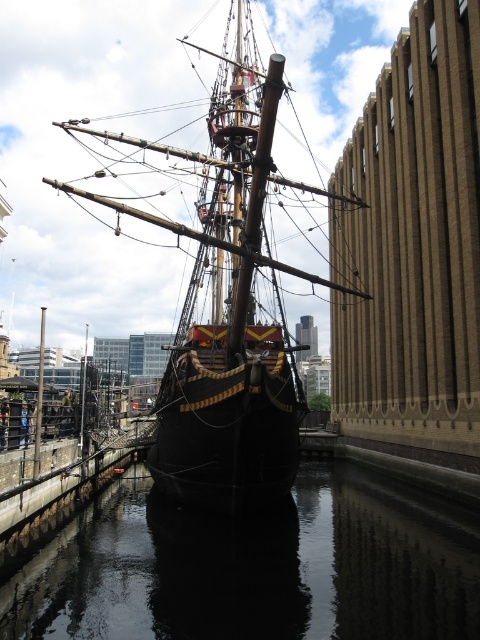
You are a tour guide explaining the historic ship to visitors. Pointing to the dark wood ship at center and the dark reflective water at center, you want to describe their spatial relationship. How would you phrase this?

The dark reflective water at center is positioned under the dark wood ship at center, indicating that the ship is floating on the water.

You are standing on the deck of the historic sailing ship and want to locate the dark reflective water at center. According to the coordinates provided, where should you look relative to your position?

The dark reflective water at center is located at coordinates point 0.886 on the x axis and 0.535 on the y axis.

You are standing on the dock next to the dark wood ship at center. You want to see your reflection in the dark reflective water at center. In which direction should you look relative to the ship?

You should look to the right of the dark wood ship at center to see the dark reflective water at center where your reflection would be visible.